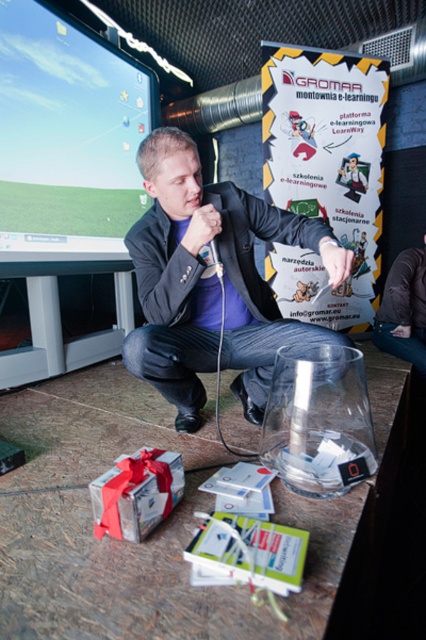
Question: Which point is closer to the camera taking this photo?

Choices:
 (A) (221, 269)
 (B) (201, 314)

Answer: (A)

Question: Does matte black monitor at upper left have a smaller size compared to metallic silver game controller at center?

Choices:
 (A) no
 (B) yes

Answer: (A)

Question: Among these points, which one is farthest from the camera?

Choices:
 (A) (258, 291)
 (B) (132, 163)
 (C) (210, 269)

Answer: (B)

Question: Is matte black jacket at center further to camera compared to matte black monitor at upper left?

Choices:
 (A) yes
 (B) no

Answer: (B)

Question: Can you confirm if matte black jacket at center is thinner than matte black monitor at upper left?

Choices:
 (A) yes
 (B) no

Answer: (B)

Question: Which point is closer to the camera?

Choices:
 (A) (16, 124)
 (B) (204, 248)
 (C) (210, 292)

Answer: (B)